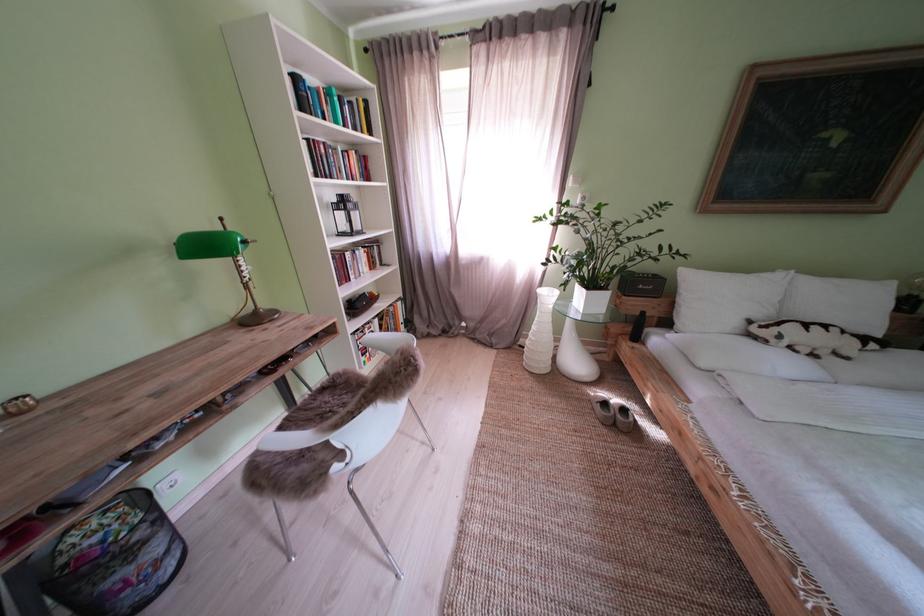
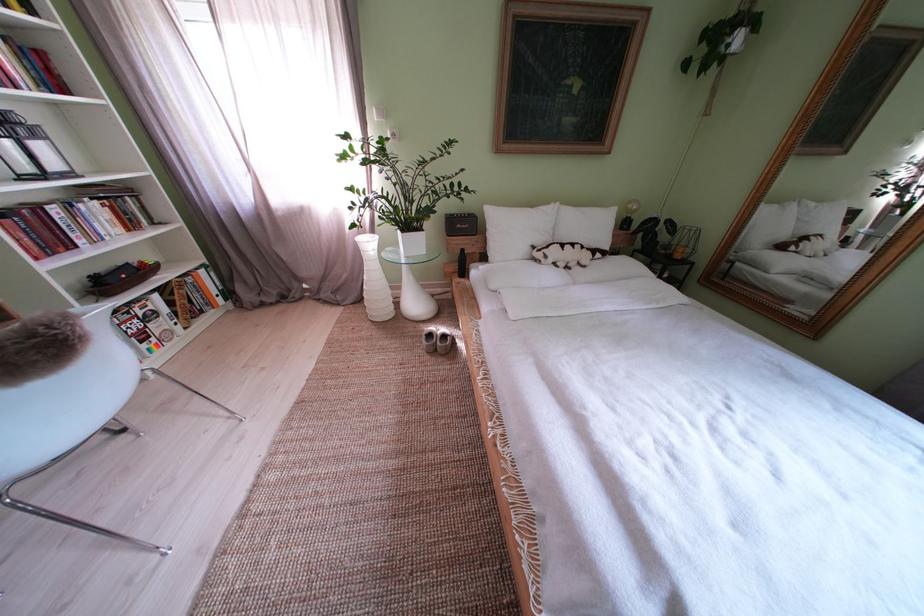
Question: The camera is either moving clockwise (left) or counter-clockwise (right) around the object. The first image is from the beginning of the video and the second image is from the end. Is the camera moving left or right when shooting the video?

Choices:
 (A) Left
 (B) Right

Answer: (A)